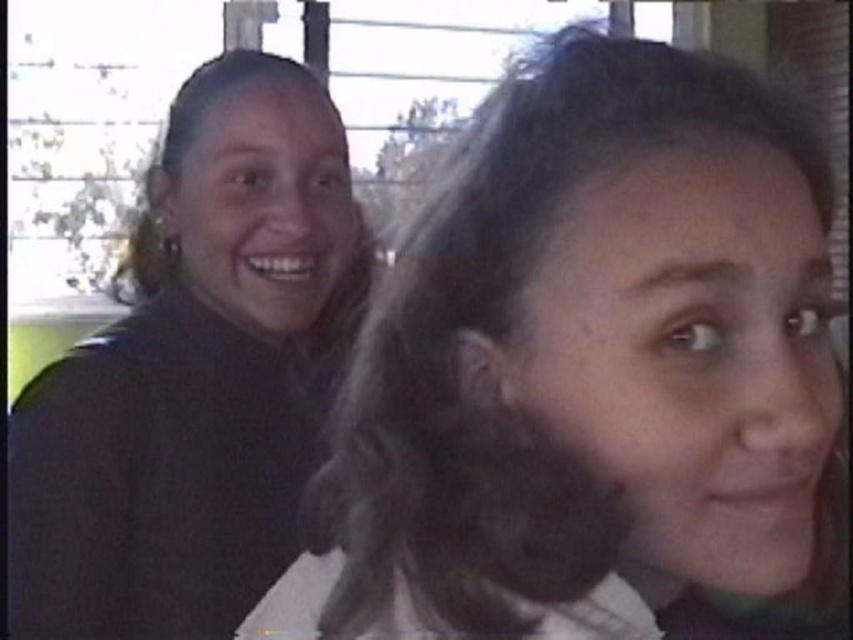
Question: Which point is closer to the camera?

Choices:
 (A) dark brown hair at upper center
 (B) matte black jacket at left

Answer: (A)

Question: Is dark brown hair at upper center to the left of matte black jacket at left from the viewer's perspective?

Choices:
 (A) no
 (B) yes

Answer: (A)

Question: Where is dark brown hair at upper center located in relation to matte black jacket at left in the image?

Choices:
 (A) right
 (B) left

Answer: (A)

Question: Which point is closer to the camera?

Choices:
 (A) (465, 468)
 (B) (270, 264)

Answer: (A)

Question: Can you confirm if dark brown hair at upper center is positioned below matte black jacket at left?

Choices:
 (A) no
 (B) yes

Answer: (B)